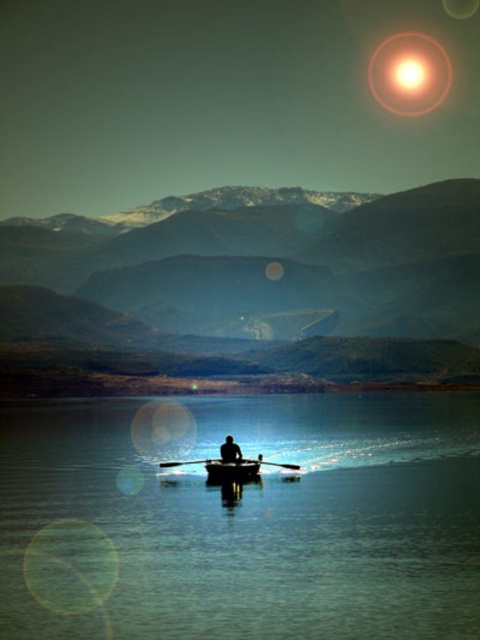
You are an observer standing on the shore of the lake. You see the transparent blue water at center and the glowing orange orb at upper right. Which object appears taller in the image?

The glowing orange orb at upper right appears taller than the transparent blue water at center in the image.

You are a photographer trying to capture the glowing orange orb at upper right in the image. Where should you point your camera to locate it?

The glowing orange orb at upper right is located at point coordinates of (409,74), so you should point your camera towards that coordinate to capture it.